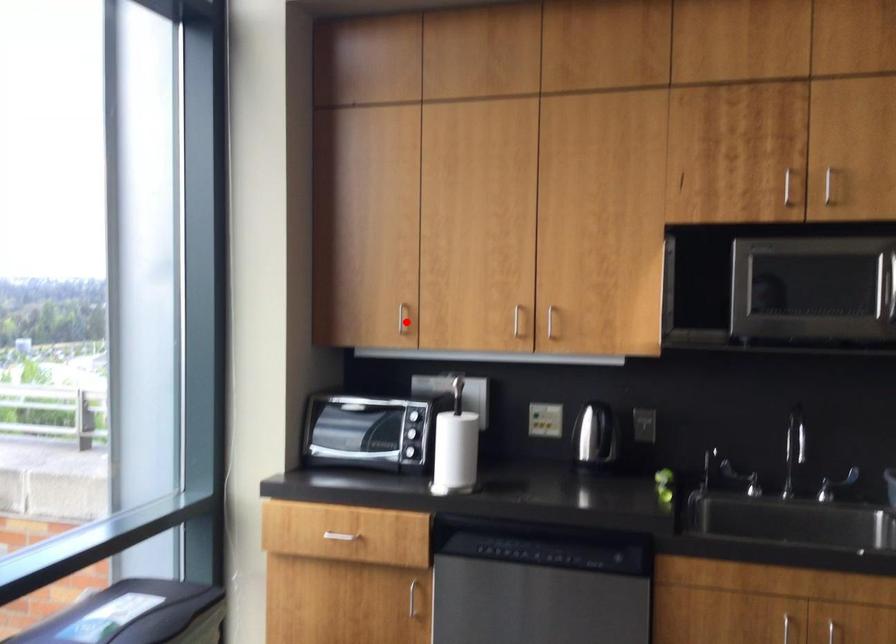
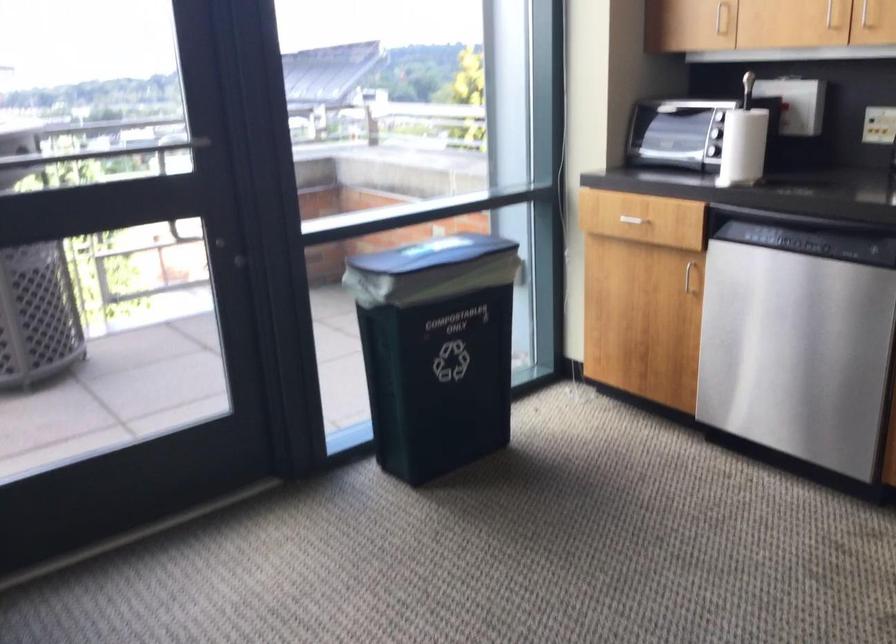
Where in the second image is the point corresponding to the highlighted location from the first image?

(721, 17)